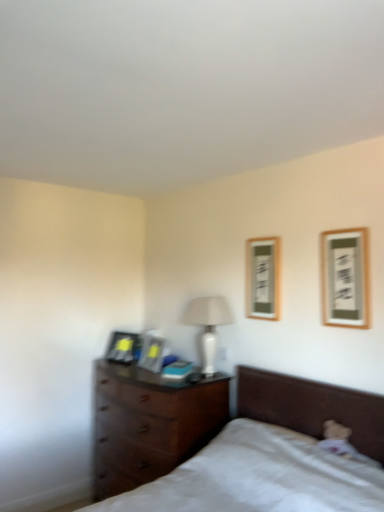
Question: Based on their sizes in the image, would you say dark wood chest of drawers at lower left is bigger or smaller than wooden framed picture at upper right, the fourth picture frame positioned from the back?

Choices:
 (A) small
 (B) big

Answer: (B)

Question: Would you say dark wood chest of drawers at lower left is inside or outside wooden framed picture at upper right, the first picture frame from the front?

Choices:
 (A) outside
 (B) inside

Answer: (A)

Question: Which object is the closest to the wooden picture frame at upper right, arranged as the third picture frame when viewed from the back?

Choices:
 (A) matte black picture frame at left, which ranks as the 1th picture frame in left-to-right order
 (B) white matte bed at lower right
 (C) dark wood chest of drawers at lower left
 (D) matte black picture frame at center, which is the 3th picture frame in front-to-back order
 (E) wooden framed picture at upper right, the fourth picture frame in the left-to-right sequence

Answer: (E)

Question: Estimate the real-world distances between objects in this image. Which object is closer to the wooden framed picture at upper right, the fourth picture frame positioned from the back?

Choices:
 (A) white matte bed at lower right
 (B) matte black picture frame at center, which is the 3th picture frame in front-to-back order
 (C) matte black picture frame at left, positioned as the first picture frame in back-to-front order
 (D) dark wood chest of drawers at lower left
 (E) white glossy table lamp at center

Answer: (E)